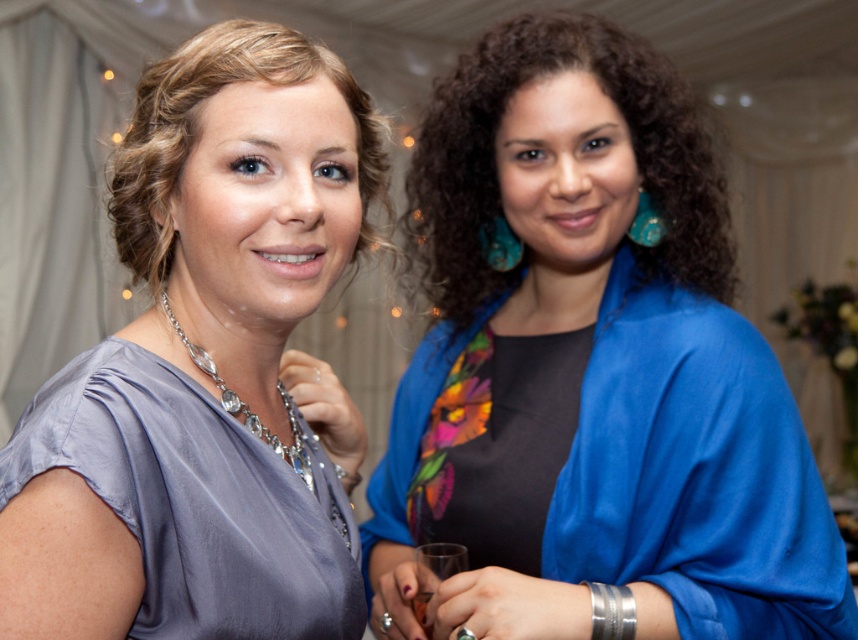
You are standing at the point with coordinates point (303, 448) and want to move to the point with coordinates point (526, 348). Are you able to walk directly to the destination without going around?

Point (526, 348) is behind point (303, 448), so you cannot walk directly to it without going around point (303, 448).

You are a photographer at a social event and need to adjust the camera settings to capture both the satin gray blouse at upper left and the satin dress at left clearly. Since the camera can only focus on one height at a time, which object should you prioritize focusing on to ensure the taller one is in focus?

The satin gray blouse at upper left is taller than the satin dress at left, so you should prioritize focusing on the satin gray blouse at upper left to ensure it is in focus.

You are at a party and want to take a photo with both the blue satin kimono at center and the swarovski crystal necklace at left. Which object should you focus on first to ensure both are in the frame?

The blue satin kimono at center has a greater height compared to the swarovski crystal necklace at left, so you should focus on the blue satin kimono at center first to ensure both are in the frame.